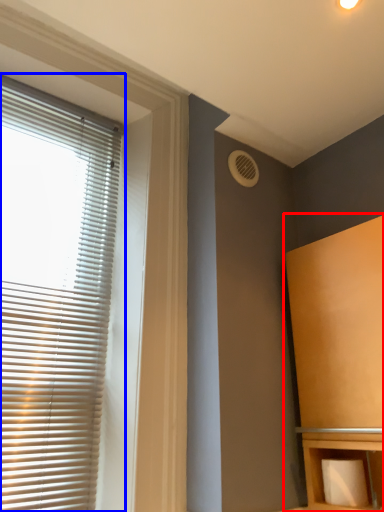
Question: Which of the following is the farthest to the observer, furniture (highlighted by a red box) or window blind (highlighted by a blue box)?

Choices:
 (A) furniture
 (B) window blind

Answer: (B)